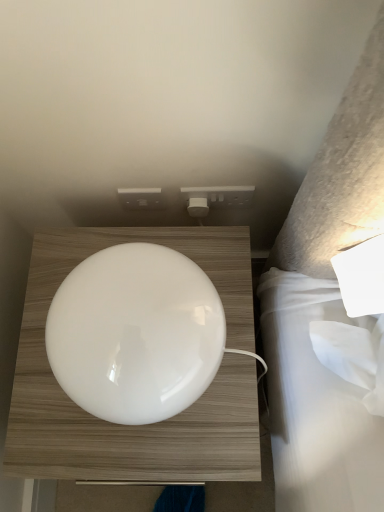
Question: Does white plastic socket at upper center lie behind white glossy lampshade at center?

Choices:
 (A) yes
 (B) no

Answer: (A)

Question: Can we say white plastic socket at upper center lies outside white glossy lampshade at center?

Choices:
 (A) no
 (B) yes

Answer: (B)

Question: Does white plastic socket at upper center come in front of white glossy lampshade at center?

Choices:
 (A) yes
 (B) no

Answer: (B)

Question: Is white plastic socket at upper center looking in the opposite direction of white glossy lampshade at center?

Choices:
 (A) yes
 (B) no

Answer: (B)

Question: Considering the relative sizes of white plastic socket at upper center and white glossy lampshade at center in the image provided, is white plastic socket at upper center bigger than white glossy lampshade at center?

Choices:
 (A) yes
 (B) no

Answer: (B)

Question: Is white plastic socket at upper center touching white glossy lampshade at center?

Choices:
 (A) yes
 (B) no

Answer: (B)

Question: From a real-world perspective, is white glossy lampshade at center on top of white plastic socket at upper center?

Choices:
 (A) yes
 (B) no

Answer: (B)

Question: Can you confirm if white glossy lampshade at center is positioned to the right of white plastic socket at upper center?

Choices:
 (A) yes
 (B) no

Answer: (B)

Question: From a real-world perspective, is white glossy lampshade at center physically below white plastic socket at upper center?

Choices:
 (A) no
 (B) yes

Answer: (B)

Question: Is there a large distance between white glossy lampshade at center and white plastic socket at upper center?

Choices:
 (A) yes
 (B) no

Answer: (B)

Question: From the image's perspective, is white glossy lampshade at center below white plastic socket at upper center?

Choices:
 (A) yes
 (B) no

Answer: (A)

Question: Is white glossy lampshade at center oriented away from white plastic socket at upper center?

Choices:
 (A) no
 (B) yes

Answer: (B)

Question: From the image's perspective, is white plastic socket at upper center positioned above or below white glossy lampshade at center?

Choices:
 (A) above
 (B) below

Answer: (A)